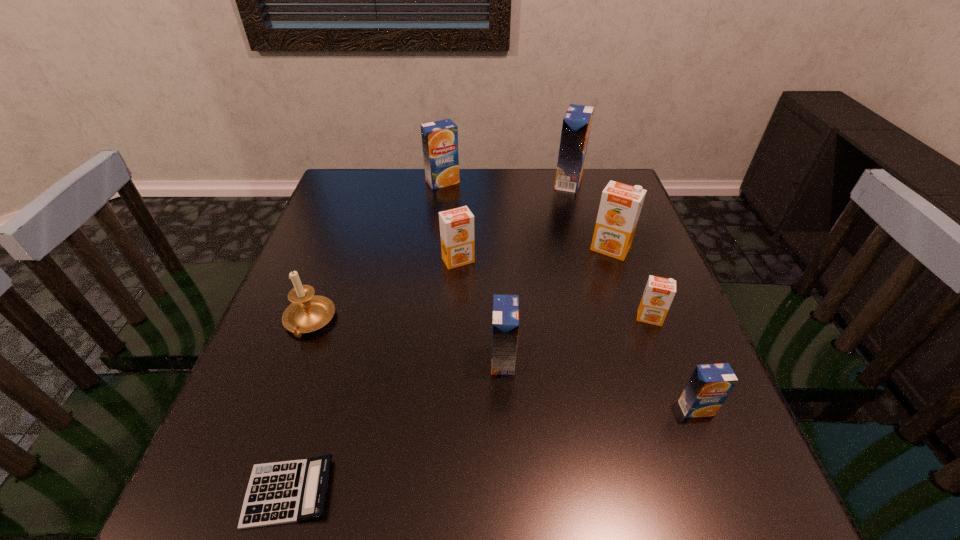
Locate an element on the screen. The image size is (960, 540). vacant space located 0.250m on the back of the nearest orange juice is located at coordinates (653, 300).

Identify the location of vacant space located on the left of the nearest orange orange juice. (546, 318).

Where is `free space located 0.080m on the right of the nearest object`? free space located 0.080m on the right of the nearest object is located at coordinates (384, 492).

Locate an element on the screen. object positioned at the near edge is located at coordinates (284, 492).

Where is `candle holder at the left edge`? The height and width of the screenshot is (540, 960). candle holder at the left edge is located at coordinates (308, 312).

Locate an element on the screen. This screenshot has width=960, height=540. calculator at the left edge is located at coordinates (284, 492).

Locate an element on the screen. The width and height of the screenshot is (960, 540). object situated at the near left corner is located at coordinates (284, 492).

The width and height of the screenshot is (960, 540). I want to click on object that is at the far right corner, so click(576, 125).

In order to click on free space at the far edge in this screenshot , I will do `click(400, 213)`.

In order to click on free spot at the near edge of the desktop in this screenshot , I will do `click(576, 529)`.